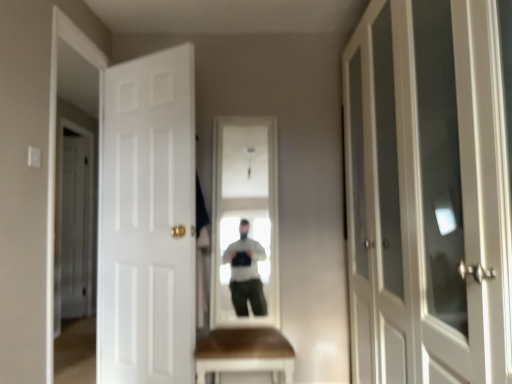
Question: Is white glass cabinet at right, the 3th door from the left, bigger than white wood door at left, the third door in the front-to-back sequence?

Choices:
 (A) no
 (B) yes

Answer: (B)

Question: Does white glass cabinet at right, which is counted as the 1th door, starting from the right, have a greater height compared to white wood door at left, the first door when ordered from left to right?

Choices:
 (A) no
 (B) yes

Answer: (A)

Question: Is white glass cabinet at right, the 3th door from the left, wider than white wood door at left, arranged as the first door when viewed from the back?

Choices:
 (A) yes
 (B) no

Answer: (A)

Question: From a real-world perspective, is white glass cabinet at right, the 3th door positioned from the back, located beneath white wood door at left, arranged as the first door when viewed from the back?

Choices:
 (A) yes
 (B) no

Answer: (B)

Question: Is white glass cabinet at right, marked as the first door in a front-to-back arrangement, not close to white wood door at left, the first door when ordered from left to right?

Choices:
 (A) no
 (B) yes

Answer: (B)

Question: Is white glass cabinet at right, the 3th door from the left, at the left side of white wood door at left, the first door when ordered from left to right?

Choices:
 (A) yes
 (B) no

Answer: (B)

Question: Is white matte door at left, placed as the 2th door when sorted from back to front, oriented away from white glass cabinet at right, marked as the first door in a front-to-back arrangement?

Choices:
 (A) yes
 (B) no

Answer: (B)

Question: Is white matte door at left, placed as the 2th door when sorted from back to front, shorter than white glass cabinet at right, which is counted as the 1th door, starting from the right?

Choices:
 (A) yes
 (B) no

Answer: (B)

Question: From the image's perspective, does white matte door at left, the 2th door positioned from the right, appear lower than white glass cabinet at right, the 3th door positioned from the back?

Choices:
 (A) yes
 (B) no

Answer: (A)

Question: Could you tell me if white matte door at left, the 2th door positioned from the right, is facing white glass cabinet at right, marked as the first door in a front-to-back arrangement?

Choices:
 (A) yes
 (B) no

Answer: (B)

Question: Is white matte door at left, the 2th door positioned from the right, taller than white glass cabinet at right, the 3th door positioned from the back?

Choices:
 (A) yes
 (B) no

Answer: (A)

Question: Is white matte door at left, the 2th door positioned from the right, to the right of white glass cabinet at right, marked as the first door in a front-to-back arrangement, from the viewer's perspective?

Choices:
 (A) no
 (B) yes

Answer: (A)

Question: Is the position of white wood door at left, the first door when ordered from left to right, more distant than that of white glass cabinet at right, the 3th door positioned from the back?

Choices:
 (A) no
 (B) yes

Answer: (B)